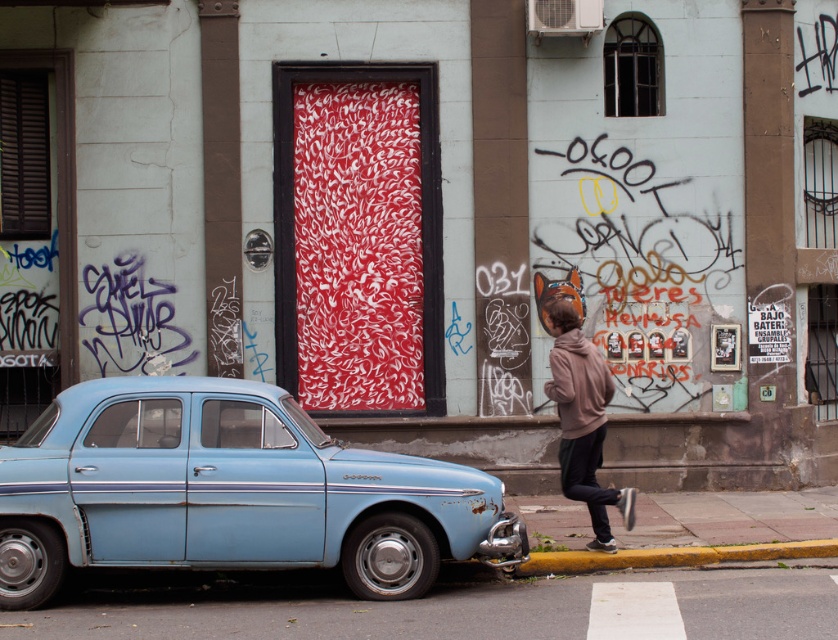
Does light blue metallic car at left come behind brown hoodie at center?

Answer: No, it is not.

Which is more to the left, light blue metallic car at left or brown hoodie at center?

From the viewer's perspective, light blue metallic car at left appears more on the left side.

Between point (164, 384) and point (561, 438), which one is positioned in front?

Point (164, 384) is more forward.

Identify the location of light blue metallic car at left. (230, 492).

Who is taller, light blue metallic car at left or yellow painted concrete curb at lower right?

Standing taller between the two is light blue metallic car at left.

I want to click on light blue metallic car at left, so click(230, 492).

Which is more to the right, brown hoodie at center or yellow painted concrete curb at lower right?

Positioned to the right is yellow painted concrete curb at lower right.

Is brown hoodie at center above yellow painted concrete curb at lower right?

Correct, brown hoodie at center is located above yellow painted concrete curb at lower right.

Is point (585, 444) farther from viewer compared to point (802, 545)?

That is False.

Locate an element on the screen. brown hoodie at center is located at coordinates (582, 420).